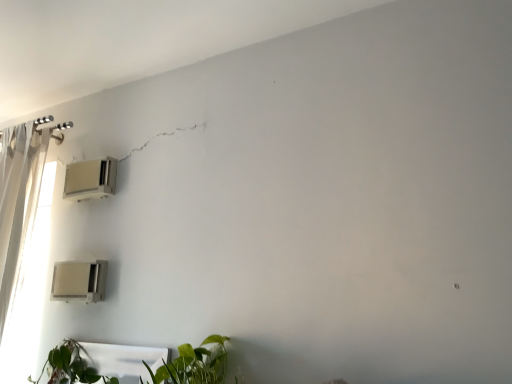
Question: Looking at their shapes, would you say green leafy plant at lower center is wider or thinner than white plastic air conditioner at upper left, acting as the 2th air conditioning starting from the bottom?

Choices:
 (A) wide
 (B) thin

Answer: (A)

Question: From the image's perspective, is green leafy plant at lower center above or below white plastic air conditioner at upper left, the 1th air conditioning positioned from the top?

Choices:
 (A) above
 (B) below

Answer: (B)

Question: Estimate the real-world distances between objects in this image. Which object is farther from the white plastic air conditioner at upper left, acting as the 2th air conditioning starting from the bottom?

Choices:
 (A) beige plastic air conditioner at lower left, arranged as the 1th air conditioning when ordered from the bottom
 (B) green leafy plant at lower center

Answer: (B)

Question: Which is nearer to the beige plastic air conditioner at lower left, arranged as the 1th air conditioning when ordered from the bottom?

Choices:
 (A) white plastic air conditioner at upper left, acting as the 2th air conditioning starting from the bottom
 (B) green leafy plant at lower center

Answer: (B)